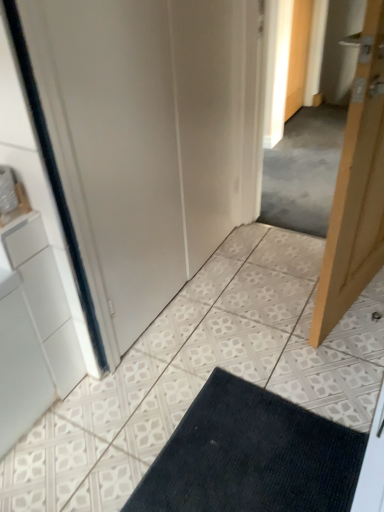
What do you see at coordinates (356, 188) in the screenshot? I see `light wood door at right, marked as the first door in a bottom-to-top arrangement` at bounding box center [356, 188].

Locate an element on the screen. light wood door at right, placed as the 2th door when sorted from back to front is located at coordinates (356, 188).

I want to click on dark blue textured bath mat at lower center, so click(251, 456).

I want to click on wooden door at upper right, the 1th door positioned from the top, so click(x=298, y=56).

From a real-world perspective, is white matte door at center on dark blue textured bath mat at lower center?

Indeed, from a real-world perspective, white matte door at center stands above dark blue textured bath mat at lower center.

Does white matte door at center have a lesser height compared to dark blue textured bath mat at lower center?

No, white matte door at center is not shorter than dark blue textured bath mat at lower center.

Considering the sizes of objects white matte door at center and dark blue textured bath mat at lower center in the image provided, who is wider, white matte door at center or dark blue textured bath mat at lower center?

white matte door at center.

What's the angular difference between light wood door at right, marked as the first door in a bottom-to-top arrangement, and dark blue textured bath mat at lower center's facing directions?

The angle between the facing direction of light wood door at right, marked as the first door in a bottom-to-top arrangement, and the facing direction of dark blue textured bath mat at lower center is 80 degrees.

Looking at the image, does light wood door at right, marked as the first door in a bottom-to-top arrangement, seem bigger or smaller compared to dark blue textured bath mat at lower center?

light wood door at right, marked as the first door in a bottom-to-top arrangement, is bigger than dark blue textured bath mat at lower center.

Which object is wider, light wood door at right, placed as the 2th door when sorted from back to front, or dark blue textured bath mat at lower center?

dark blue textured bath mat at lower center.

Can you confirm if light wood door at right, placed as the 2th door when sorted from back to front, is positioned to the right of dark blue textured bath mat at lower center?

Yes, light wood door at right, placed as the 2th door when sorted from back to front, is to the right of dark blue textured bath mat at lower center.

Does dark blue textured bath mat at lower center have a greater width compared to wooden door at upper right, which is the 2th door in bottom-to-top order?

Correct, the width of dark blue textured bath mat at lower center exceeds that of wooden door at upper right, which is the 2th door in bottom-to-top order.

From the image's perspective, does dark blue textured bath mat at lower center appear lower than wooden door at upper right, the 1th door positioned from the top?

Yes, from the image's perspective, dark blue textured bath mat at lower center is below wooden door at upper right, the 1th door positioned from the top.

Which of these two, dark blue textured bath mat at lower center or wooden door at upper right, which is counted as the 2th door, starting from the front, is smaller?

dark blue textured bath mat at lower center.

From a real-world perspective, between dark blue textured bath mat at lower center and wooden door at upper right, which is the 2th door in bottom-to-top order, who is vertically lower?

In real-world perspective, dark blue textured bath mat at lower center is lower.

From the image's perspective, which one is positioned lower, wooden door at upper right, the 1th door positioned from the top, or dark blue textured bath mat at lower center?

dark blue textured bath mat at lower center is shown below in the image.

Is wooden door at upper right, which is counted as the 2th door, starting from the front, in contact with dark blue textured bath mat at lower center?

No, wooden door at upper right, which is counted as the 2th door, starting from the front, is not next to dark blue textured bath mat at lower center.

Looking at this image, considering the relative positions of wooden door at upper right, the 1th door from the back, and dark blue textured bath mat at lower center in the image provided, is wooden door at upper right, the 1th door from the back, to the right of dark blue textured bath mat at lower center from the viewer's perspective?

Correct, you'll find wooden door at upper right, the 1th door from the back, to the right of dark blue textured bath mat at lower center.

Measure the distance from wooden door at upper right, which is counted as the 2th door, starting from the front, to dark blue textured bath mat at lower center.

wooden door at upper right, which is counted as the 2th door, starting from the front, is 2.76 meters away from dark blue textured bath mat at lower center.

In order to click on screen door above the wooden door at upper right, the 1th door positioned from the top (from a real-world perspective) in this screenshot , I will do `click(115, 150)`.

From a real-world perspective, is wooden door at upper right, which is the 2th door in bottom-to-top order, positioned above or below white matte door at center?

In terms of real-world spatial position, wooden door at upper right, which is the 2th door in bottom-to-top order, is below white matte door at center.

Is point (292, 67) closer or farther from the camera than point (113, 6)?

Point (292, 67) appears to be farther away from the viewer than point (113, 6).

Is white matte door at center completely or partially inside wooden door at upper right, the 1th door positioned from the top?

No, white matte door at center is not surrounded by wooden door at upper right, the 1th door positioned from the top.

From the image's perspective, is light wood door at right, marked as the first door in a bottom-to-top arrangement, located above or below wooden door at upper right, the 1th door from the back?

From the image's perspective, light wood door at right, marked as the first door in a bottom-to-top arrangement, appears below wooden door at upper right, the 1th door from the back.

Does light wood door at right, the 2th door positioned from the top, turn towards wooden door at upper right, which is the 2th door in bottom-to-top order?

No, light wood door at right, the 2th door positioned from the top, is not aimed at wooden door at upper right, which is the 2th door in bottom-to-top order.

Looking at this image, considering the sizes of objects light wood door at right, acting as the first door starting from the front, and wooden door at upper right, which is the 2th door in bottom-to-top order, in the image provided, who is shorter, light wood door at right, acting as the first door starting from the front, or wooden door at upper right, which is the 2th door in bottom-to-top order,?

Standing shorter between the two is wooden door at upper right, which is the 2th door in bottom-to-top order.

Looking at this image, based on their sizes in the image, would you say light wood door at right, placed as the 2th door when sorted from back to front, is bigger or smaller than white matte door at center?

Considering their sizes, light wood door at right, placed as the 2th door when sorted from back to front, takes up less space than white matte door at center.

Considering the relative sizes of light wood door at right, marked as the first door in a bottom-to-top arrangement, and white matte door at center in the image provided, is light wood door at right, marked as the first door in a bottom-to-top arrangement, thinner than white matte door at center?

Yes.

Is light wood door at right, acting as the first door starting from the front, not inside white matte door at center?

Indeed, light wood door at right, acting as the first door starting from the front, is completely outside white matte door at center.

From the picture: From a real-world perspective, is light wood door at right, acting as the first door starting from the front, physically below white matte door at center?

Yes, from a real-world perspective, light wood door at right, acting as the first door starting from the front, is beneath white matte door at center.

Identify the location of bath mat on the right of the white matte door at center. (251, 456).

Locate an element on the screen. The image size is (384, 512). the 1st door above the dark blue textured bath mat at lower center (from the image's perspective) is located at coordinates (356, 188).

Considering their positions, is light wood door at right, marked as the first door in a bottom-to-top arrangement, positioned further to dark blue textured bath mat at lower center than white matte door at center?

Based on the image, white matte door at center appears to be further to dark blue textured bath mat at lower center.

Which object lies nearer to the anchor point dark blue textured bath mat at lower center, light wood door at right, placed as the 2th door when sorted from back to front, or wooden door at upper right, which is the 2th door in bottom-to-top order?

light wood door at right, placed as the 2th door when sorted from back to front, lies closer to dark blue textured bath mat at lower center than the other object.

When comparing their distances from light wood door at right, placed as the 2th door when sorted from back to front, does wooden door at upper right, which is counted as the 2th door, starting from the front, or white matte door at center seem further?

wooden door at upper right, which is counted as the 2th door, starting from the front.

From the image, which object appears to be farther from wooden door at upper right, which is counted as the 2th door, starting from the front, light wood door at right, placed as the 2th door when sorted from back to front, or white matte door at center?

white matte door at center is further to wooden door at upper right, which is counted as the 2th door, starting from the front.

Looking at this image, when comparing their distances from light wood door at right, marked as the first door in a bottom-to-top arrangement, does dark blue textured bath mat at lower center or wooden door at upper right, which is the 2th door in bottom-to-top order, seem further?

wooden door at upper right, which is the 2th door in bottom-to-top order.

Based on their spatial positions, is dark blue textured bath mat at lower center or light wood door at right, the 2th door positioned from the top, further from wooden door at upper right, the 1th door from the back?

dark blue textured bath mat at lower center lies further to wooden door at upper right, the 1th door from the back, than the other object.

Based on their spatial positions, is dark blue textured bath mat at lower center or white matte door at center closer to light wood door at right, acting as the first door starting from the front?

dark blue textured bath mat at lower center is positioned closer to the anchor light wood door at right, acting as the first door starting from the front.

Which object lies nearer to the anchor point wooden door at upper right, the 1th door from the back, dark blue textured bath mat at lower center or white matte door at center?

The object closer to wooden door at upper right, the 1th door from the back, is white matte door at center.

Find the location of `door between wooden door at upper right, the 1th door positioned from the top, and dark blue textured bath mat at lower center from top to bottom`. door between wooden door at upper right, the 1th door positioned from the top, and dark blue textured bath mat at lower center from top to bottom is located at coordinates (356, 188).

Find the location of a particular element. door between white matte door at center and dark blue textured bath mat at lower center from top to bottom is located at coordinates (356, 188).

At what (x,y) coordinates should I click in order to perform the action: click on door positioned between white matte door at center and wooden door at upper right, the 1th door positioned from the top, from near to far. Please return your answer as a coordinate pair (x, y). This screenshot has height=512, width=384. Looking at the image, I should click on (356, 188).

You are a GUI agent. You are given a task and a screenshot of the screen. Output one action in this format:
    pyautogui.click(x=<x>, y=<y>)
    Task: Click on the bath mat located between white matte door at center and wooden door at upper right, which is counted as the 2th door, starting from the front, in the depth direction
    The image size is (384, 512).
    Given the screenshot: What is the action you would take?
    pyautogui.click(x=251, y=456)